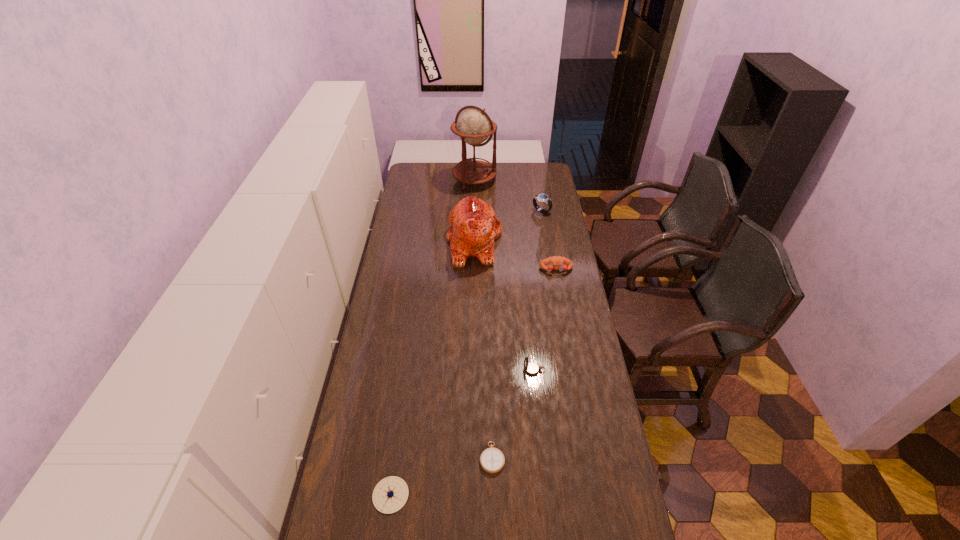
You are a GUI agent. You are given a task and a screenshot of the screen. Output one action in this format:
    pyautogui.click(x=<x>, y=<y>)
    Task: Click on the free region that satisfies the following two spatial constraints: 1. on the surface of the second compass from right to left; 2. on the right side of the tallest object
    The height and width of the screenshot is (540, 960).
    Given the screenshot: What is the action you would take?
    pos(469,457)

Find the location of a particular element. vacant space that satisfies the following two spatial constraints: 1. on the surface of the shortest object; 2. on the left side of the farthest object is located at coordinates (469, 457).

Where is `vacant area that satisfies the following two spatial constraints: 1. on the surface of the shortest compass; 2. on the left side of the tallest object`? The height and width of the screenshot is (540, 960). vacant area that satisfies the following two spatial constraints: 1. on the surface of the shortest compass; 2. on the left side of the tallest object is located at coordinates click(469, 457).

The image size is (960, 540). Find the location of `free spot that satisfies the following two spatial constraints: 1. on the face of the rightmost compass; 2. on the front side of the leftmost compass`. free spot that satisfies the following two spatial constraints: 1. on the face of the rightmost compass; 2. on the front side of the leftmost compass is located at coordinates (547, 495).